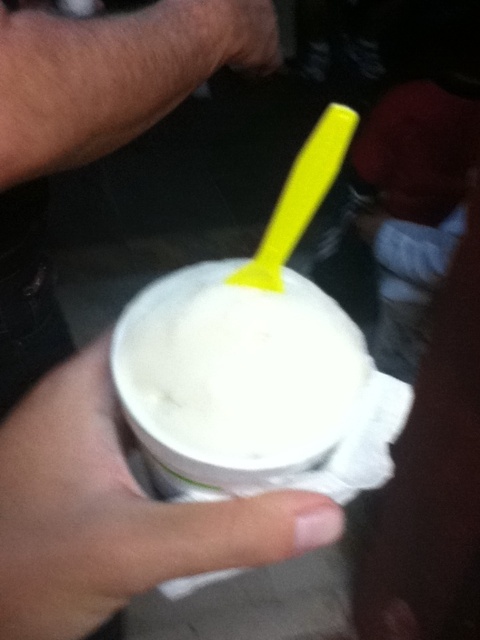
Does point (14, 630) lie in front of point (171, 273)?

Yes.

Looking at this image, which is below, white matte cup at center or white matte ice cream at center?

Positioned lower is white matte cup at center.

This screenshot has height=640, width=480. I want to click on white matte cup at center, so click(x=113, y=513).